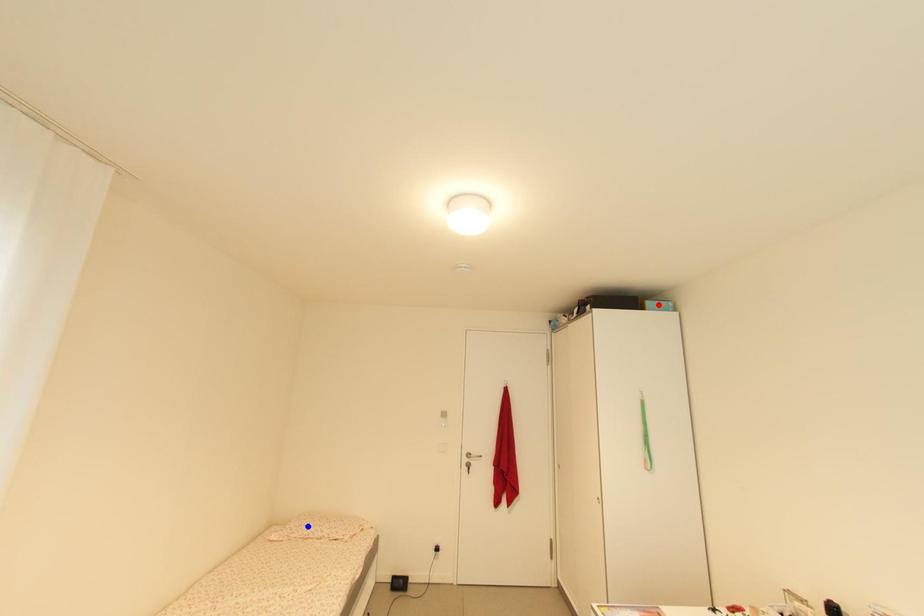
Question: Two points are marked on the image. Which point is closer to the camera?

Choices:
 (A) Blue point is closer.
 (B) Red point is closer.

Answer: (B)